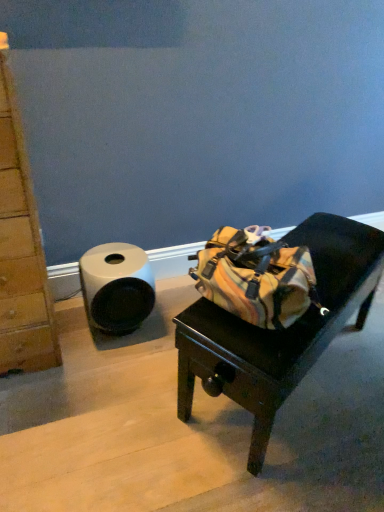
Question: From the image's perspective, relative to multicolored fabric bag at center, is white matte toilet paper at left above or below?

Choices:
 (A) above
 (B) below

Answer: (A)

Question: Is white matte toilet paper at left in front of or behind multicolored fabric bag at center in the image?

Choices:
 (A) front
 (B) behind

Answer: (B)

Question: From a real-world perspective, relative to multicolored fabric bag at center, is white matte toilet paper at left vertically above or below?

Choices:
 (A) below
 (B) above

Answer: (A)

Question: Is multicolored fabric bag at center taller or shorter than white matte toilet paper at left?

Choices:
 (A) tall
 (B) short

Answer: (A)

Question: In the image, is multicolored fabric bag at center positioned in front of or behind white matte toilet paper at left?

Choices:
 (A) front
 (B) behind

Answer: (A)

Question: Is multicolored fabric bag at center situated inside white matte toilet paper at left or outside?

Choices:
 (A) outside
 (B) inside

Answer: (A)

Question: From the image's perspective, is multicolored fabric bag at center located above or below white matte toilet paper at left?

Choices:
 (A) above
 (B) below

Answer: (B)